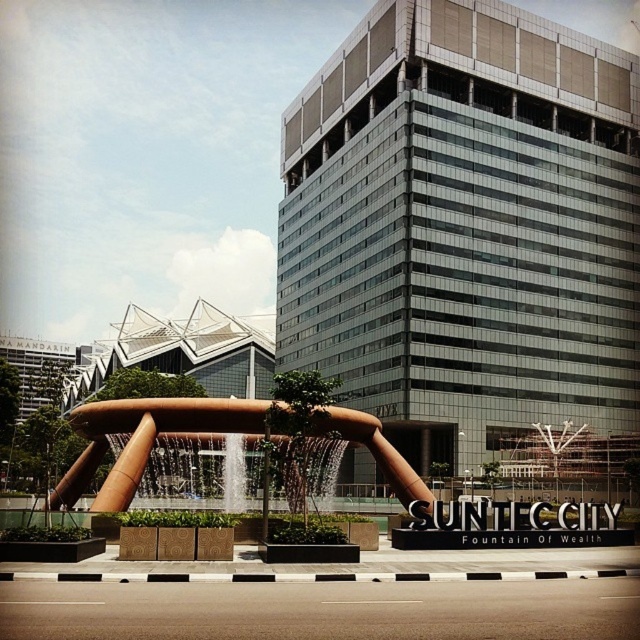
Is gold metallic sculpture at center wider than clear glass water at center?

Yes.

Is gold metallic sculpture at center to the right of clear glass water at center from the viewer's perspective?

In fact, gold metallic sculpture at center is to the left of clear glass water at center.

Does point (161, 432) come farther from viewer compared to point (275, 490)?

No, (161, 432) is closer to viewer.

This screenshot has height=640, width=640. What are the coordinates of `gold metallic sculpture at center` in the screenshot? It's located at (145, 440).